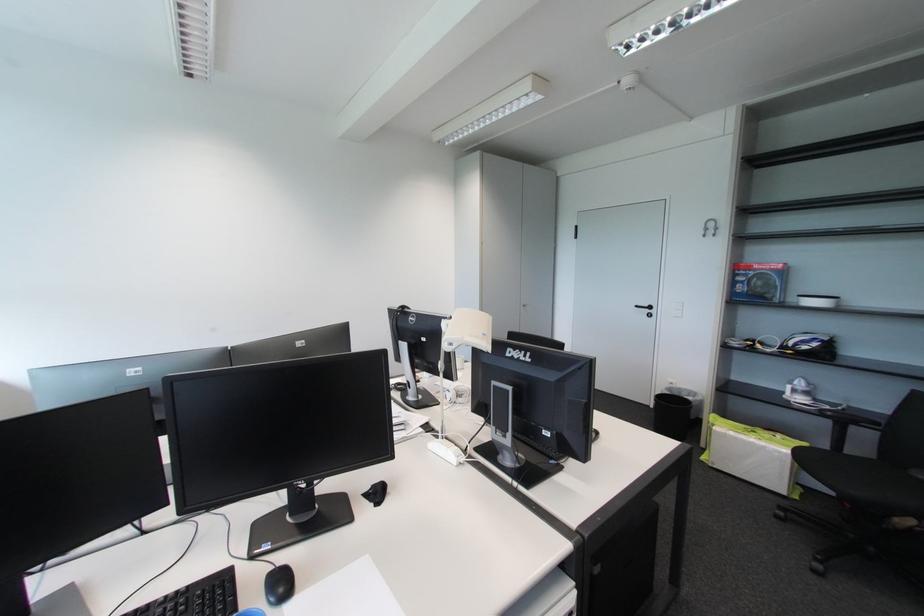
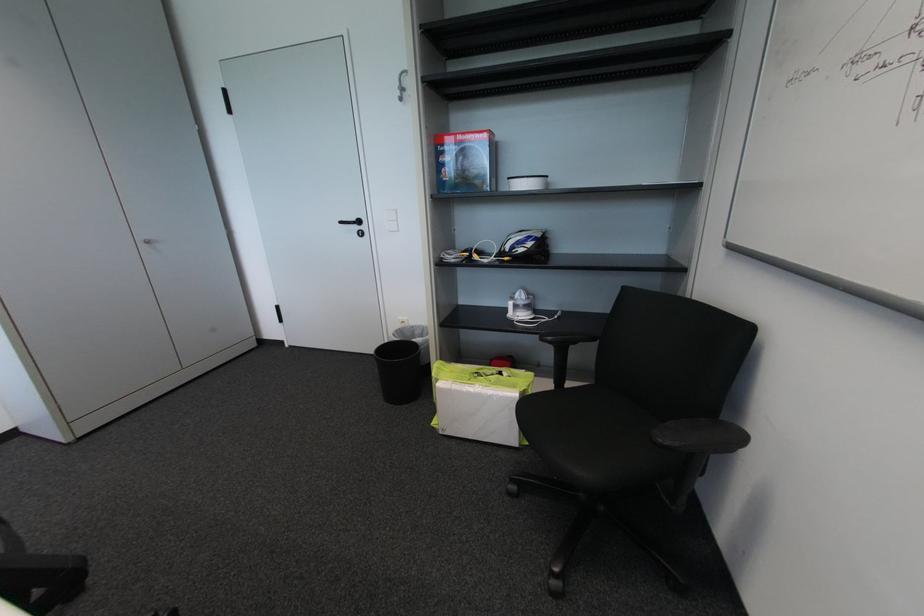
In the second image, find the point that corresponds to point 757,274 in the first image.

(460, 148)